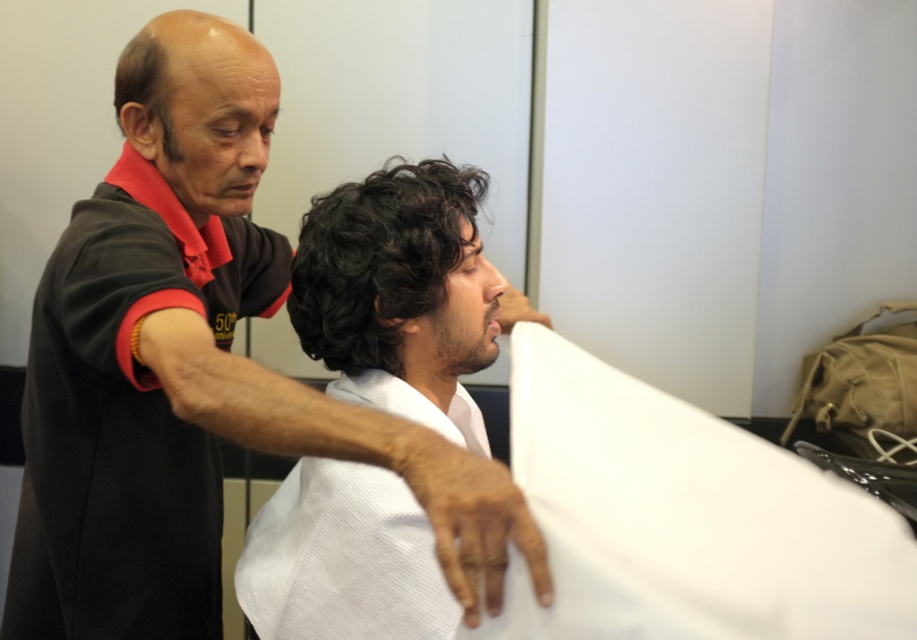
Between point (191, 400) and point (332, 515), which one is positioned in front?

Point (191, 400) is more forward.

Between black matte shirt at upper left and white cloth at center, which one is positioned lower?

black matte shirt at upper left is lower down.

Which is in front, point (131, 269) or point (263, 528)?

Positioned in front is point (131, 269).

Locate an element on the screen. This screenshot has height=640, width=917. black matte shirt at upper left is located at coordinates [195, 380].

Is point (409, 604) in front of point (315, 316)?

Yes, it is in front of point (315, 316).

Does white cloth at center have a smaller size compared to black curly hair at center?

Actually, white cloth at center might be larger than black curly hair at center.

Is point (438, 321) closer to viewer compared to point (428, 177)?

Yes, it is.

You are a GUI agent. You are given a task and a screenshot of the screen. Output one action in this format:
    pyautogui.click(x=<x>, y=<y>)
    Task: Click on the white cloth at center
    Image resolution: width=917 pixels, height=640 pixels.
    Given the screenshot: What is the action you would take?
    pyautogui.click(x=398, y=292)

Identify the location of white textured cloth at center. (683, 518).

Is white textured cloth at center to the left of dark brown hair at upper left from the viewer's perspective?

No, white textured cloth at center is not to the left of dark brown hair at upper left.

Which is behind, point (728, 614) or point (133, 38)?

The point (133, 38) is behind.

Find the location of a particular element. white textured cloth at center is located at coordinates (683, 518).